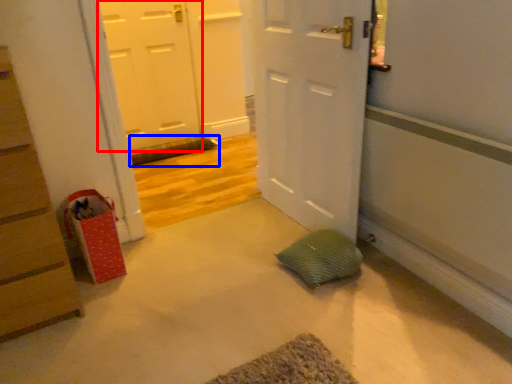
Question: Which object appears closest to the camera in this image, door (highlighted by a red box) or bath mat (highlighted by a blue box)?

Choices:
 (A) door
 (B) bath mat

Answer: (A)